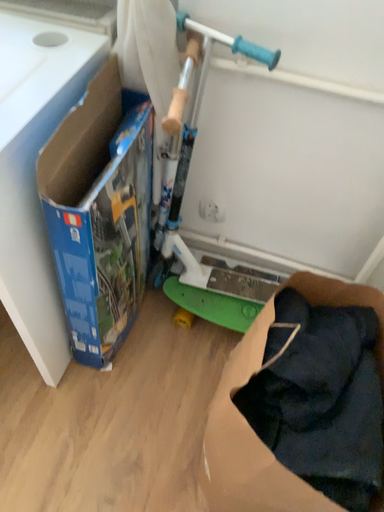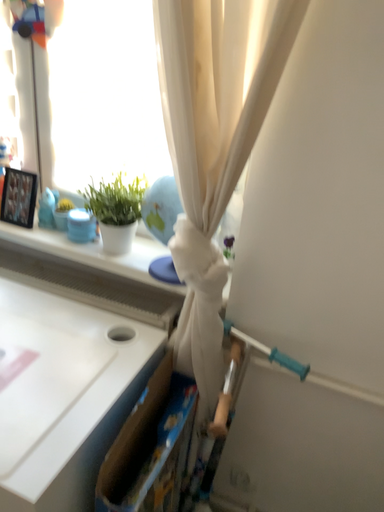
Question: How did the camera likely rotate when shooting the video?

Choices:
 (A) rotated upward
 (B) rotated downward

Answer: (A)